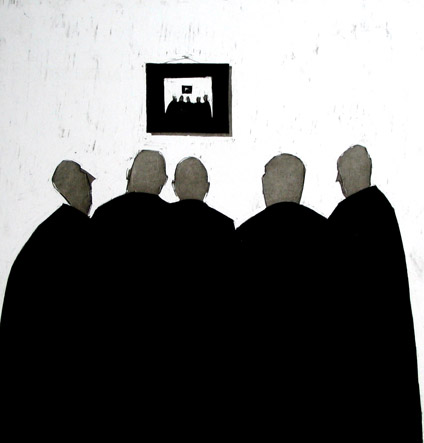
Image resolution: width=424 pixels, height=443 pixels. What are the coordinates of `white wall` in the screenshot? It's located at (200, 86).